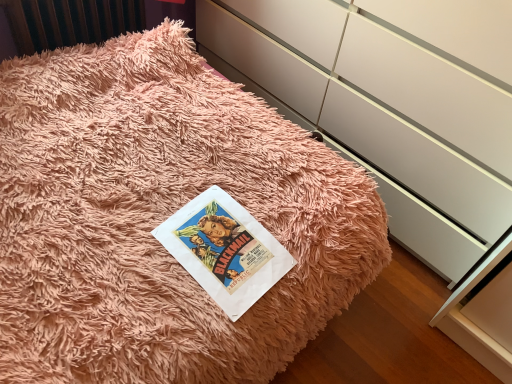
This screenshot has width=512, height=384. Find the location of `free space above vintage paper at center (from a real-world perspective)`. free space above vintage paper at center (from a real-world perspective) is located at coordinates (220, 238).